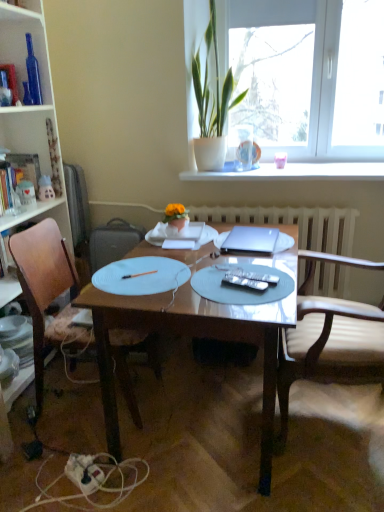
Find the location of a particular element. vacant point above white matte paper plate at center, the first paper plate in the left-to-right sequence (from a real-world perspective) is located at coordinates (139, 274).